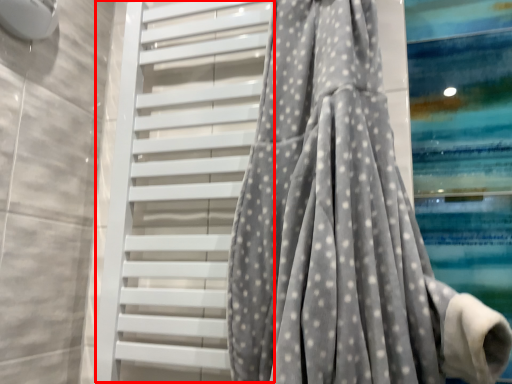
Question: From the image's perspective, considering the relative positions of shutter (annotated by the red box) and curtain in the image provided, where is shutter (annotated by the red box) located with respect to the staircase?

Choices:
 (A) below
 (B) above

Answer: (A)